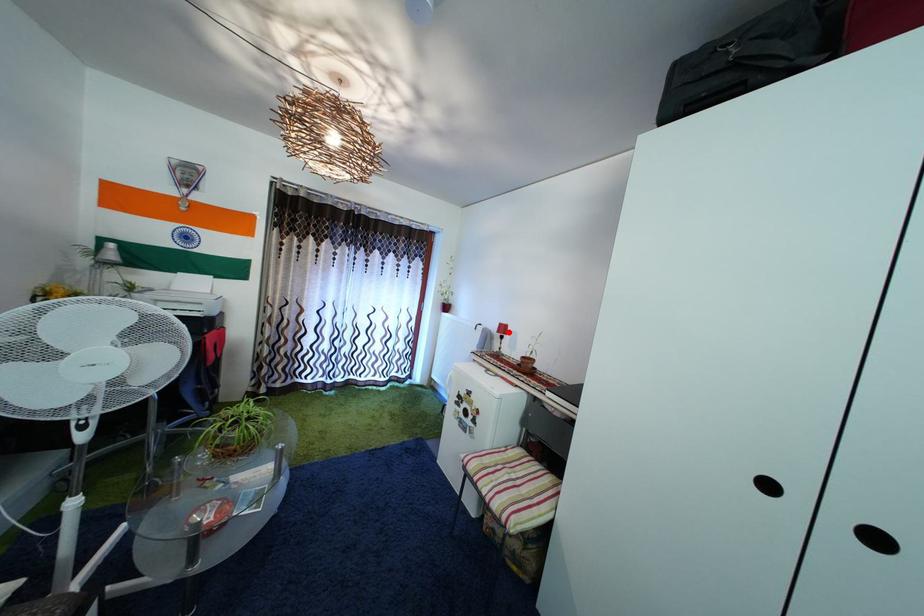
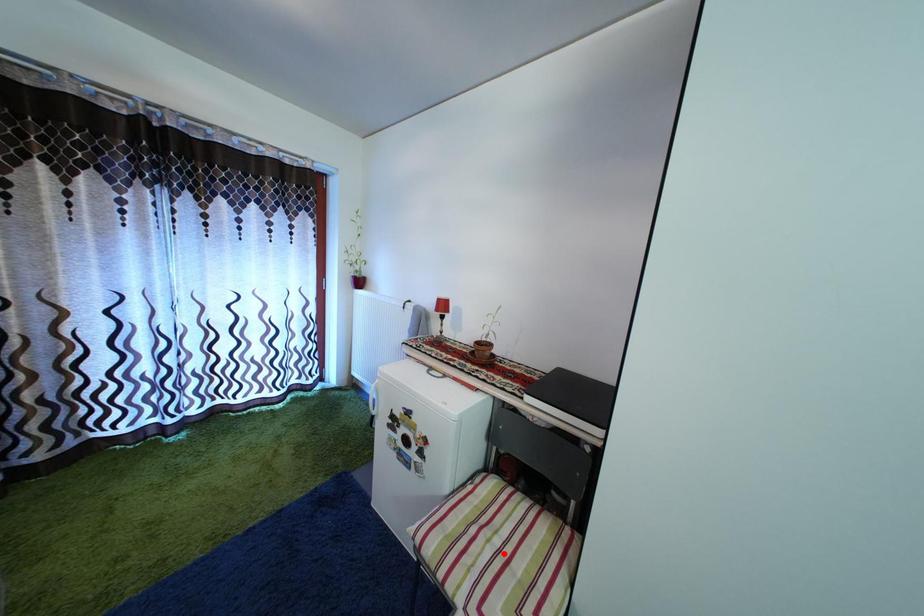
I am providing you with two images of the same scene from different viewpoints. A red point is marked on the first image and another point is marked on the second image. Is the red point in image1 aligned with the point shown in image2?

No